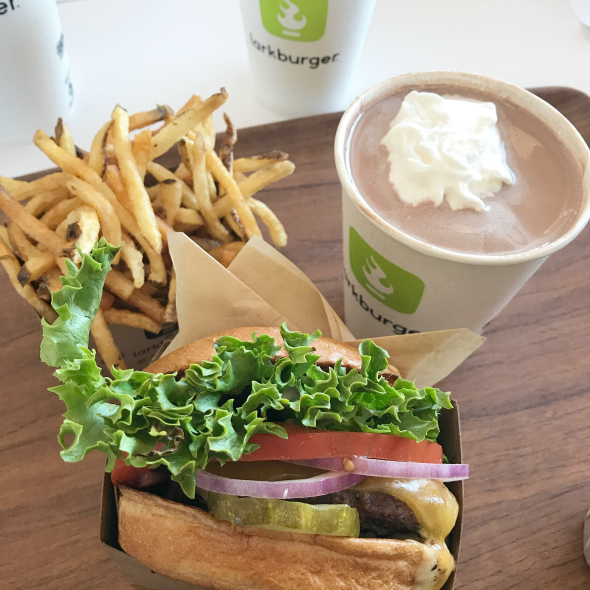
Image resolution: width=590 pixels, height=590 pixels. In order to click on cups in this screenshot , I will do `click(290, 73)`, `click(413, 306)`, `click(22, 22)`.